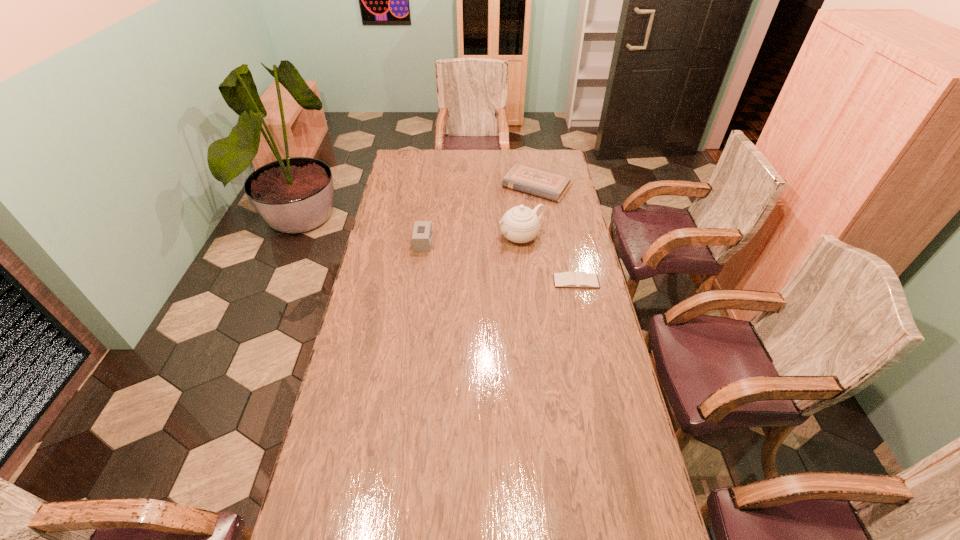
Locate an element on the screen. This screenshot has height=540, width=960. empty location between the leftmost object and the tallest object is located at coordinates (472, 240).

Identify the location of vacant area between the leftmost object and the chinaware. The width and height of the screenshot is (960, 540). (472, 240).

Locate an element on the screen. vacant area that lies between the second tallest object and the farthest object is located at coordinates (480, 214).

This screenshot has width=960, height=540. In order to click on free space that is in between the Bible and the leftmost object in this screenshot , I will do `click(480, 214)`.

The height and width of the screenshot is (540, 960). I want to click on unoccupied area between the tallest object and the nearest object, so click(548, 259).

The width and height of the screenshot is (960, 540). I want to click on object that is the nearest to the chinaware, so click(569, 279).

Locate which object is the second closest to the chinaware. Please provide its 2D coordinates. Your answer should be formatted as a tuple, i.e. [(x, y)], where the tuple contains the x and y coordinates of a point satisfying the conditions above.

[(537, 181)]

This screenshot has height=540, width=960. I want to click on vacant area that satisfies the following two spatial constraints: 1. on the back side of the Bible; 2. on the right side of the tallest object, so click(x=516, y=186).

This screenshot has height=540, width=960. I want to click on vacant point that satisfies the following two spatial constraints: 1. on the front side of the shortest object; 2. on the right side of the chinaware, so click(x=525, y=281).

Identify the location of free spot that satisfies the following two spatial constraints: 1. on the back side of the tallest object; 2. on the right side of the Bible. Image resolution: width=960 pixels, height=540 pixels. (516, 186).